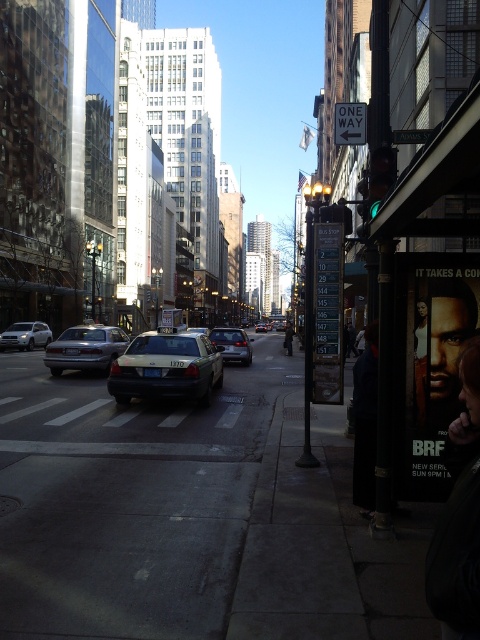
Question: Which is nearer to the metallic one way sign at center?

Choices:
 (A) dark blue jeans at lower right
 (B) metallic silver street sign at upper center
 (C) silver metallic sedan at left

Answer: (B)

Question: Does matte black taxi at center appear on the left side of metallic silver street sign at upper center?

Choices:
 (A) yes
 (B) no

Answer: (A)

Question: Where is satin silver sedan at center located in relation to matte silver sedan at center in the image?

Choices:
 (A) left
 (B) right

Answer: (A)

Question: Based on their relative distances, which object is nearer to the matte black taxi at center?

Choices:
 (A) smooth skin face at right
 (B) matte silver sedan at center

Answer: (B)

Question: Can you confirm if smooth skin face at lower right is thinner than silver metallic sedan at left?

Choices:
 (A) yes
 (B) no

Answer: (A)

Question: Which of the following is the closest to the observer?

Choices:
 (A) coord(476,545)
 (B) coord(348,336)
 (C) coord(124,372)

Answer: (A)